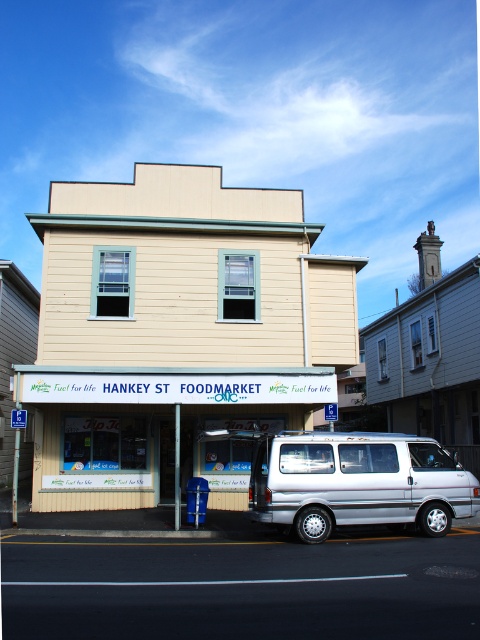
From the picture: Which is below, beige wood hankey st foodmarket at center or silver metallic van at center?

silver metallic van at center is lower down.

Does point (84, 310) come closer to viewer compared to point (257, 445)?

No, (84, 310) is further to viewer.

Who is more forward, (83, 257) or (406, 444)?

Positioned in front is point (406, 444).

Find the location of a particular element. This screenshot has width=480, height=640. beige wood hankey st foodmarket at center is located at coordinates (175, 330).